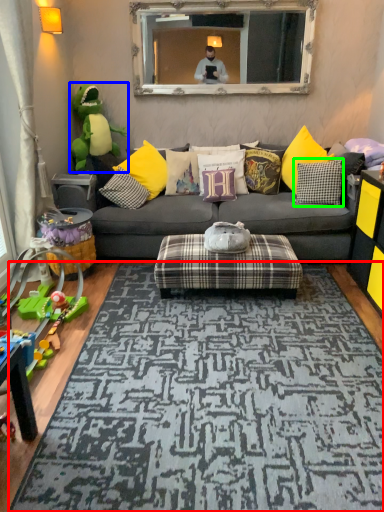
Question: Which object is the closest to the mat (highlighted by a red box)? Choose among these: toy (highlighted by a blue box) or pillow (highlighted by a green box).

Choices:
 (A) toy
 (B) pillow

Answer: (B)